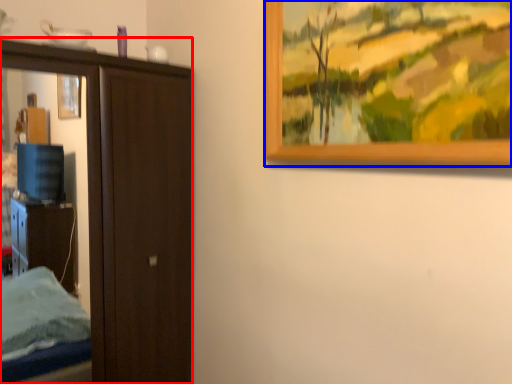
Question: Among these objects, which one is nearest to the camera, door (highlighted by a red box) or picture frame (highlighted by a blue box)?

Choices:
 (A) door
 (B) picture frame

Answer: (B)